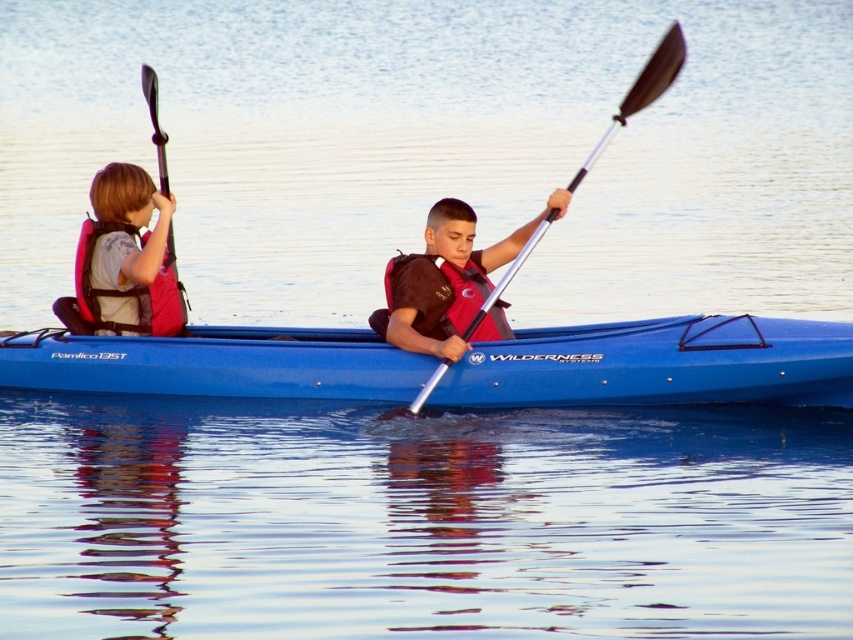
Question: Where is red matte life jacket at center located in relation to silver metallic paddle at center in the image?

Choices:
 (A) above
 (B) below

Answer: (B)

Question: Which of the following is the closest to the observer?

Choices:
 (A) brown fabric life vest at center
 (B) blue plastic canoe at center

Answer: (B)

Question: Which of these objects is positioned closest to the silver metallic paddle at center?

Choices:
 (A) red matte life jacket at center
 (B) brown fabric life vest at center
 (C) matte pink life jacket at left

Answer: (A)

Question: Which object appears closest to the camera in this image?

Choices:
 (A) brown fabric life vest at center
 (B) silver metallic paddle at center

Answer: (B)

Question: Can you confirm if blue plastic canoe at center is thinner than silver metallic paddle at center?

Choices:
 (A) yes
 (B) no

Answer: (B)

Question: Can you confirm if blue plastic canoe at center is positioned to the right of silver metallic paddle at center?

Choices:
 (A) no
 (B) yes

Answer: (A)